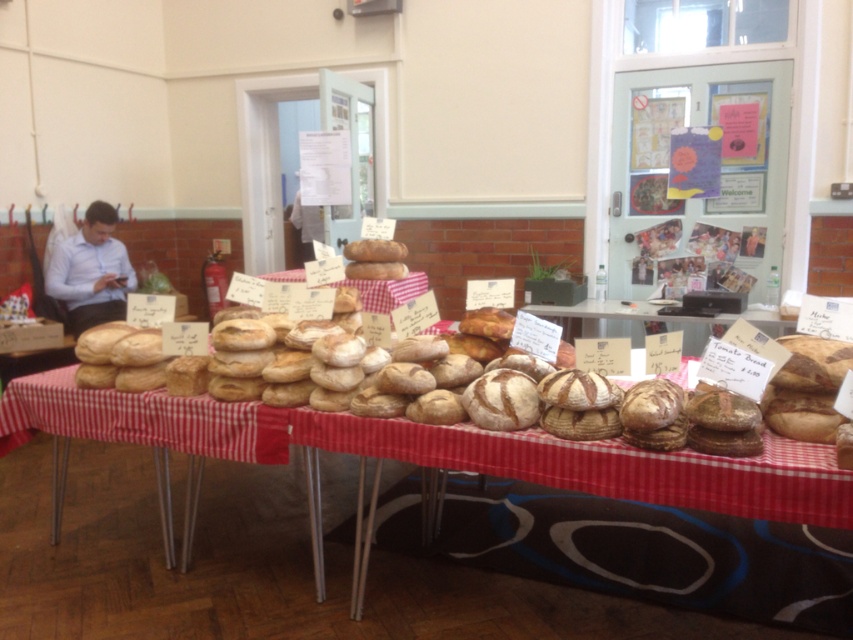
Question: Where is matte brown bread at center located in relation to matte blue shirt at left in the image?

Choices:
 (A) right
 (B) left

Answer: (A)

Question: Does matte brown bread at center have a smaller size compared to matte blue shirt at left?

Choices:
 (A) yes
 (B) no

Answer: (B)

Question: Among these objects, which one is nearest to the camera?

Choices:
 (A) matte brown bread at center
 (B) matte blue shirt at left

Answer: (A)

Question: From the image, what is the correct spatial relationship of matte brown bread at center in relation to matte blue shirt at left?

Choices:
 (A) left
 (B) right

Answer: (B)

Question: Which point is farther from the camera taking this photo?

Choices:
 (A) (393, 426)
 (B) (112, 208)

Answer: (B)